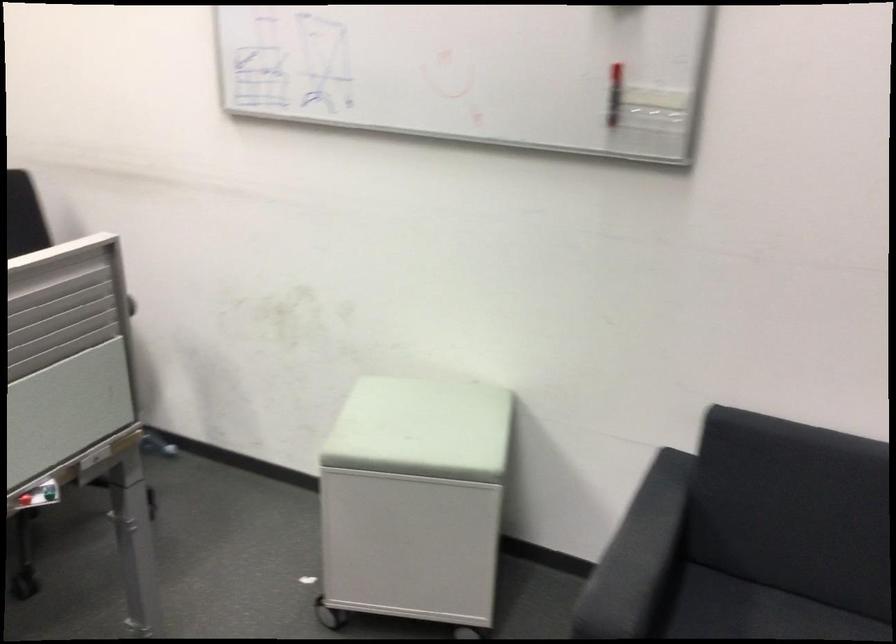
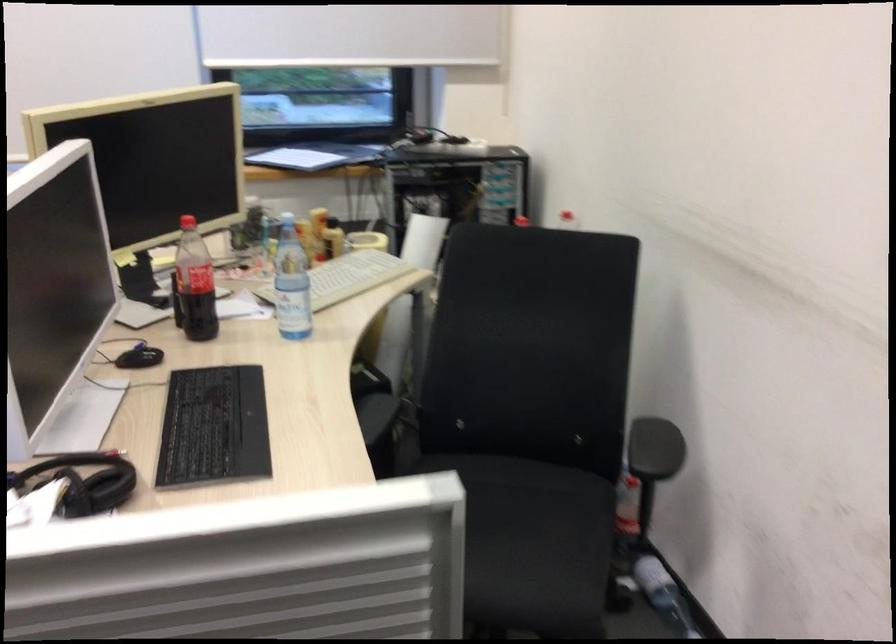
Question: Based on the continuous images, in which direction is the camera rotating? Reply with the corresponding letter.

Choices:
 (A) Left
 (B) Right
 (C) Up
 (D) Down

Answer: (A)